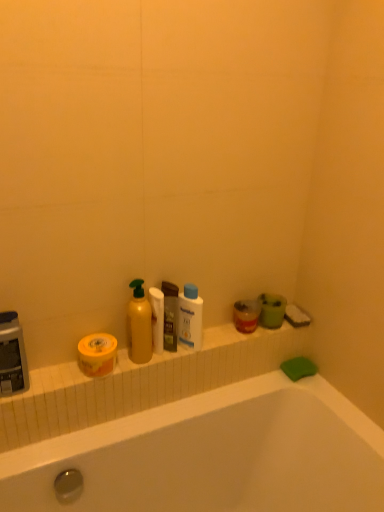
You are a GUI agent. You are given a task and a screenshot of the screen. Output one action in this format:
    pyautogui.click(x=<x>, y=<y>)
    Task: Click on the translucent plastic mouthwash at center, which is the 1th mouthwash in right-to-left order
    The height and width of the screenshot is (512, 384).
    Given the screenshot: What is the action you would take?
    click(x=170, y=315)

Measure the distance between yellow matte bottle at center, which appears as the second cleaning product when viewed from the right, and camera.

yellow matte bottle at center, which appears as the second cleaning product when viewed from the right, is 3.78 feet from camera.

Describe the element at coordinates (139, 324) in the screenshot. This screenshot has height=512, width=384. I see `yellow matte bottle at center, which appears as the second cleaning product when viewed from the right` at that location.

From the picture: Measure the distance between white plastic bottle at center, acting as the first cleaning product starting from the right, and camera.

white plastic bottle at center, acting as the first cleaning product starting from the right, is 3.99 feet from camera.

In order to face white matte toilet paper at center, should I rotate leftwards or rightwards?

It's best to rotate left around 4.728 degrees.

Where is `white matte toilet paper at center`? The image size is (384, 512). white matte toilet paper at center is located at coordinates [157, 318].

You are a GUI agent. You are given a task and a screenshot of the screen. Output one action in this format:
    pyautogui.click(x=<x>, y=<y>)
    Task: Click on the translucent plastic mouthwash at center, which is the 1th mouthwash in right-to-left order
    The image size is (384, 512).
    Given the screenshot: What is the action you would take?
    pyautogui.click(x=170, y=315)

Looking at their sizes, would you say yellow matte bottle at center, which appears as the second cleaning product when viewed from the right, is wider or thinner than white matte toilet paper at center?

Considering their sizes, yellow matte bottle at center, which appears as the second cleaning product when viewed from the right, looks broader than white matte toilet paper at center.

Considering the sizes of objects yellow matte bottle at center, positioned as the first cleaning product in left-to-right order, and white matte toilet paper at center in the image provided, who is smaller, yellow matte bottle at center, positioned as the first cleaning product in left-to-right order, or white matte toilet paper at center?

Smaller between the two is white matte toilet paper at center.

The width and height of the screenshot is (384, 512). What are the coordinates of `toilet paper behind the yellow matte bottle at center, which appears as the second cleaning product when viewed from the right` in the screenshot? It's located at (157, 318).

Is yellow matte jar at left, which is the 1th mouthwash from left to right, taller or shorter than translucent plastic mouthwash at center, which is the 1th mouthwash in right-to-left order?

Considering their sizes, yellow matte jar at left, which is the 1th mouthwash from left to right, has less height than translucent plastic mouthwash at center, which is the 1th mouthwash in right-to-left order.

How much distance is there between yellow matte jar at left, which is the 1th mouthwash from left to right, and translucent plastic mouthwash at center, marked as the second mouthwash in a left-to-right arrangement?

8.03 inches.

This screenshot has height=512, width=384. In order to click on mouthwash behind the yellow matte jar at left, which is the 1th mouthwash from left to right in this screenshot , I will do `click(170, 315)`.

From a real-world perspective, is yellow matte jar at left, which is the 1th mouthwash from left to right, on top of translucent plastic mouthwash at center, which is the 1th mouthwash in right-to-left order?

Actually, yellow matte jar at left, which is the 1th mouthwash from left to right, is physically below translucent plastic mouthwash at center, which is the 1th mouthwash in right-to-left order, in the real world.

Considering the sizes of objects translucent plastic mouthwash at center, marked as the second mouthwash in a left-to-right arrangement, and yellow matte jar at left, which is the 1th mouthwash from left to right, in the image provided, who is taller, translucent plastic mouthwash at center, marked as the second mouthwash in a left-to-right arrangement, or yellow matte jar at left, which is the 1th mouthwash from left to right,?

translucent plastic mouthwash at center, marked as the second mouthwash in a left-to-right arrangement.

Between translucent plastic mouthwash at center, which is the 1th mouthwash in right-to-left order, and yellow matte jar at left, which is the 1th mouthwash from left to right, which one is positioned behind?

translucent plastic mouthwash at center, which is the 1th mouthwash in right-to-left order, is behind.

Which object is thinner, translucent plastic mouthwash at center, which is the 1th mouthwash in right-to-left order, or yellow matte jar at left, which ranks as the second mouthwash in right-to-left order?

translucent plastic mouthwash at center, which is the 1th mouthwash in right-to-left order, is thinner.

Which object is positioned more to the right, translucent plastic mouthwash at center, marked as the second mouthwash in a left-to-right arrangement, or yellow matte jar at left, which is the 1th mouthwash from left to right?

Positioned to the right is translucent plastic mouthwash at center, marked as the second mouthwash in a left-to-right arrangement.

What's the angular difference between white matte toilet paper at center and yellow matte jar at left, which is the 1th mouthwash from left to right,'s facing directions?

0.000169 degrees separate the facing orientations of white matte toilet paper at center and yellow matte jar at left, which is the 1th mouthwash from left to right.

Where is `toilet paper above the yellow matte jar at left, which is the 1th mouthwash from left to right (from the image's perspective)`? The width and height of the screenshot is (384, 512). toilet paper above the yellow matte jar at left, which is the 1th mouthwash from left to right (from the image's perspective) is located at coordinates (157, 318).

Considering the positions of point (158, 314) and point (108, 372), is point (158, 314) closer or farther from the camera than point (108, 372)?

Point (158, 314) is farther from the camera than point (108, 372).

How much distance is there between white matte toilet paper at center and yellow matte jar at left, which is the 1th mouthwash from left to right?

They are 15.98 centimeters apart.

Could you tell me if yellow matte jar at left, which ranks as the second mouthwash in right-to-left order, is facing yellow matte bottle at center, positioned as the first cleaning product in left-to-right order?

No, yellow matte jar at left, which ranks as the second mouthwash in right-to-left order, does not turn towards yellow matte bottle at center, positioned as the first cleaning product in left-to-right order.

Which of these two, yellow matte jar at left, which is the 1th mouthwash from left to right, or yellow matte bottle at center, which appears as the second cleaning product when viewed from the right, stands taller?

yellow matte bottle at center, which appears as the second cleaning product when viewed from the right.

Is yellow matte jar at left, which is the 1th mouthwash from left to right, outside of yellow matte bottle at center, positioned as the first cleaning product in left-to-right order?

yellow matte jar at left, which is the 1th mouthwash from left to right, is positioned outside yellow matte bottle at center, positioned as the first cleaning product in left-to-right order.

From a real-world perspective, is white plastic bottle at center, arranged as the 2th cleaning product when viewed from the left, above or below yellow matte bottle at center, which appears as the second cleaning product when viewed from the right?

white plastic bottle at center, arranged as the 2th cleaning product when viewed from the left, is situated lower than yellow matte bottle at center, which appears as the second cleaning product when viewed from the right, in the real world.

Relative to yellow matte bottle at center, which appears as the second cleaning product when viewed from the right, is white plastic bottle at center, arranged as the 2th cleaning product when viewed from the left, in front or behind?

white plastic bottle at center, arranged as the 2th cleaning product when viewed from the left, is behind yellow matte bottle at center, which appears as the second cleaning product when viewed from the right.

Is white plastic bottle at center, acting as the first cleaning product starting from the right, inside the boundaries of yellow matte bottle at center, positioned as the first cleaning product in left-to-right order, or outside?

white plastic bottle at center, acting as the first cleaning product starting from the right, cannot be found inside yellow matte bottle at center, positioned as the first cleaning product in left-to-right order.

Which object is positioned more to the left, white plastic bottle at center, acting as the first cleaning product starting from the right, or translucent plastic mouthwash at center, marked as the second mouthwash in a left-to-right arrangement?

translucent plastic mouthwash at center, marked as the second mouthwash in a left-to-right arrangement, is more to the left.

From the image's perspective, between white plastic bottle at center, acting as the first cleaning product starting from the right, and translucent plastic mouthwash at center, marked as the second mouthwash in a left-to-right arrangement, who is located below?

translucent plastic mouthwash at center, marked as the second mouthwash in a left-to-right arrangement, is shown below in the image.

Is white plastic bottle at center, acting as the first cleaning product starting from the right, placed right next to translucent plastic mouthwash at center, marked as the second mouthwash in a left-to-right arrangement?

Yes, white plastic bottle at center, acting as the first cleaning product starting from the right, is touching translucent plastic mouthwash at center, marked as the second mouthwash in a left-to-right arrangement.

In the scene shown: Who is bigger, white plastic bottle at center, acting as the first cleaning product starting from the right, or translucent plastic mouthwash at center, marked as the second mouthwash in a left-to-right arrangement?

white plastic bottle at center, acting as the first cleaning product starting from the right, is bigger.

The image size is (384, 512). There is a white matte toilet paper at center. Find the location of `the 2nd cleaning product above it (from a real-world perspective)`. the 2nd cleaning product above it (from a real-world perspective) is located at coordinates (139, 324).

Where is `mouthwash located behind the yellow matte jar at left, which is the 1th mouthwash from left to right`? Image resolution: width=384 pixels, height=512 pixels. mouthwash located behind the yellow matte jar at left, which is the 1th mouthwash from left to right is located at coordinates [170, 315].

Based on their spatial positions, is yellow matte bottle at center, positioned as the first cleaning product in left-to-right order, or yellow matte jar at left, which is the 1th mouthwash from left to right, closer to white matte toilet paper at center?

Among the two, yellow matte bottle at center, positioned as the first cleaning product in left-to-right order, is located nearer to white matte toilet paper at center.

Estimate the real-world distances between objects in this image. Which object is further from translucent plastic mouthwash at center, which is the 1th mouthwash in right-to-left order, yellow matte jar at left, which is the 1th mouthwash from left to right, or yellow matte bottle at center, which appears as the second cleaning product when viewed from the right?

Based on the image, yellow matte jar at left, which is the 1th mouthwash from left to right, appears to be further to translucent plastic mouthwash at center, which is the 1th mouthwash in right-to-left order.

Considering their positions, is white matte toilet paper at center positioned further to white plastic bottle at center, arranged as the 2th cleaning product when viewed from the left, than yellow matte bottle at center, positioned as the first cleaning product in left-to-right order?

Among the two, yellow matte bottle at center, positioned as the first cleaning product in left-to-right order, is located further to white plastic bottle at center, arranged as the 2th cleaning product when viewed from the left.

When comparing their distances from yellow matte jar at left, which ranks as the second mouthwash in right-to-left order, does white matte toilet paper at center or yellow matte bottle at center, positioned as the first cleaning product in left-to-right order, seem closer?

Among the two, yellow matte bottle at center, positioned as the first cleaning product in left-to-right order, is located nearer to yellow matte jar at left, which ranks as the second mouthwash in right-to-left order.

Looking at the image, which one is located further to white plastic bottle at center, acting as the first cleaning product starting from the right, translucent plastic mouthwash at center, which is the 1th mouthwash in right-to-left order, or white matte toilet paper at center?

Based on the image, white matte toilet paper at center appears to be further to white plastic bottle at center, acting as the first cleaning product starting from the right.

When comparing their distances from white matte toilet paper at center, does translucent plastic mouthwash at center, which is the 1th mouthwash in right-to-left order, or yellow matte jar at left, which ranks as the second mouthwash in right-to-left order, seem further?

yellow matte jar at left, which ranks as the second mouthwash in right-to-left order, is further to white matte toilet paper at center.

When comparing their distances from white plastic bottle at center, arranged as the 2th cleaning product when viewed from the left, does yellow matte bottle at center, which appears as the second cleaning product when viewed from the right, or white matte toilet paper at center seem further?

Based on the image, yellow matte bottle at center, which appears as the second cleaning product when viewed from the right, appears to be further to white plastic bottle at center, arranged as the 2th cleaning product when viewed from the left.

Which object lies nearer to the anchor point white plastic bottle at center, acting as the first cleaning product starting from the right, white matte toilet paper at center or yellow matte jar at left, which is the 1th mouthwash from left to right?

Based on the image, white matte toilet paper at center appears to be nearer to white plastic bottle at center, acting as the first cleaning product starting from the right.

At what (x,y) coordinates should I click in order to perform the action: click on cleaning product between yellow matte jar at left, which ranks as the second mouthwash in right-to-left order, and translucent plastic mouthwash at center, which is the 1th mouthwash in right-to-left order. Please return your answer as a coordinate pair (x, y). The height and width of the screenshot is (512, 384). Looking at the image, I should click on click(139, 324).

Locate an element on the screen. cleaning product between yellow matte jar at left, which ranks as the second mouthwash in right-to-left order, and white matte toilet paper at center from left to right is located at coordinates (139, 324).

This screenshot has height=512, width=384. I want to click on toilet paper located between yellow matte bottle at center, positioned as the first cleaning product in left-to-right order, and translucent plastic mouthwash at center, which is the 1th mouthwash in right-to-left order, in the depth direction, so click(157, 318).

Identify the location of toilet paper between yellow matte bottle at center, positioned as the first cleaning product in left-to-right order, and white plastic bottle at center, arranged as the 2th cleaning product when viewed from the left. (157, 318).